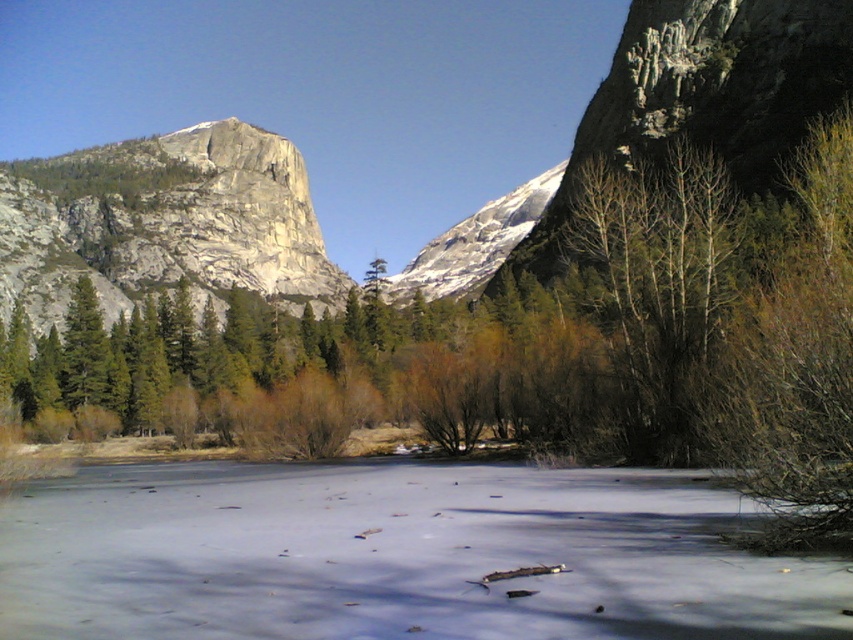
Which is more to the right, frozen ice at center or granite cliff at left?

frozen ice at center

Between point (123, 520) and point (287, 221), which one is positioned behind?

The point (287, 221) is behind.

Find the location of a particular element. This screenshot has width=853, height=640. frozen ice at center is located at coordinates (397, 556).